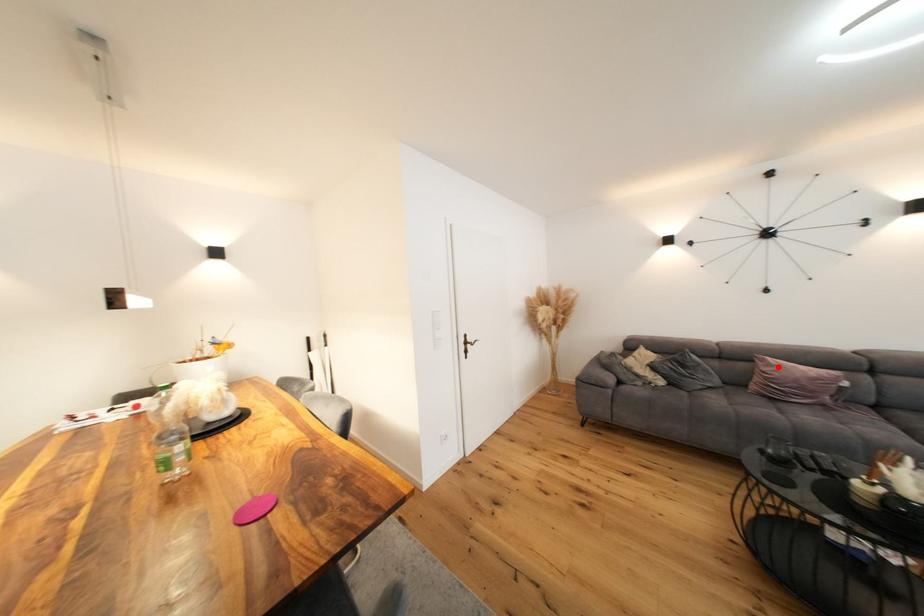
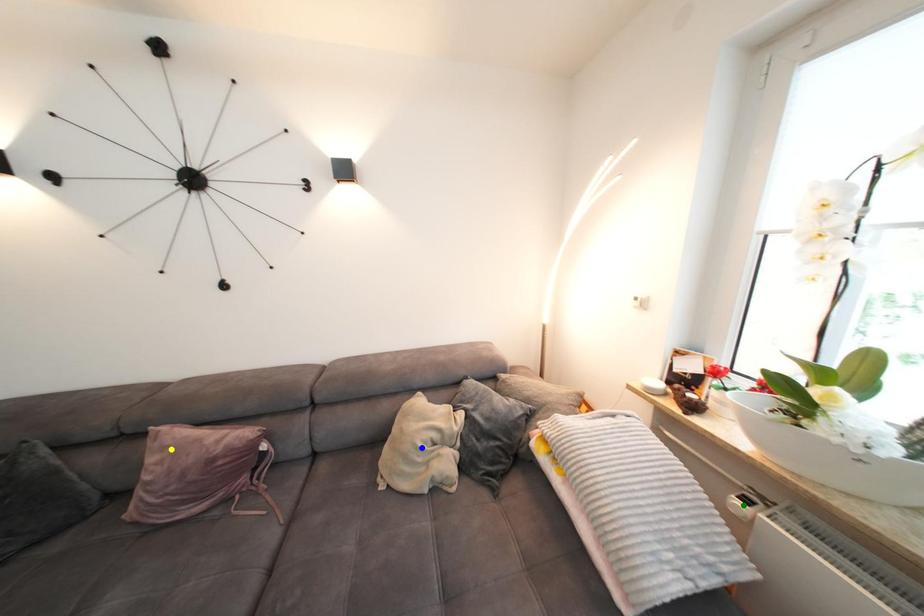
Question: I am providing you with two images of the same scene from different viewpoints. A red point is marked on the first image. You are given multiple points on the second image. In image 2, which mark is for the same physical point as the one in image 1?

Choices:
 (A) blue point
 (B) yellow point
 (C) green point

Answer: (B)